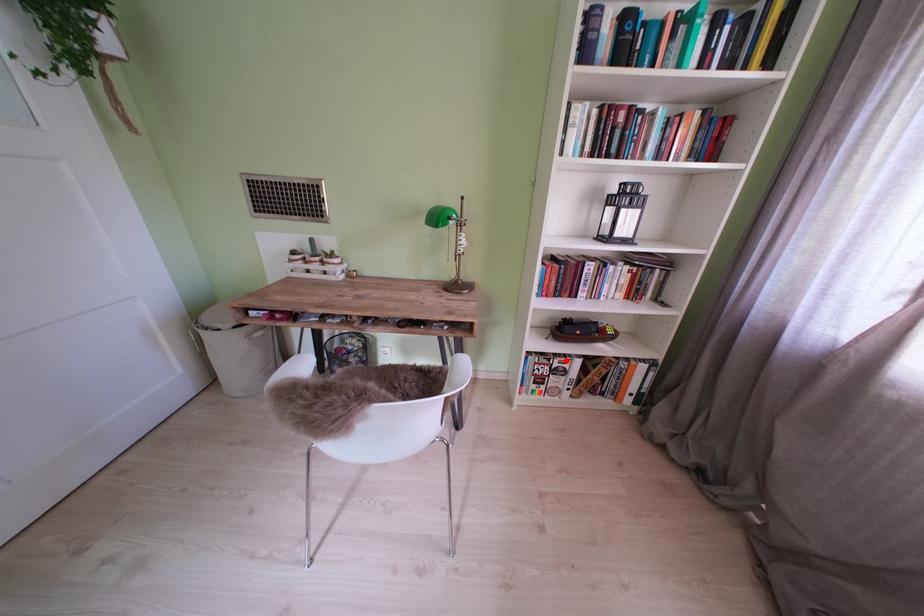
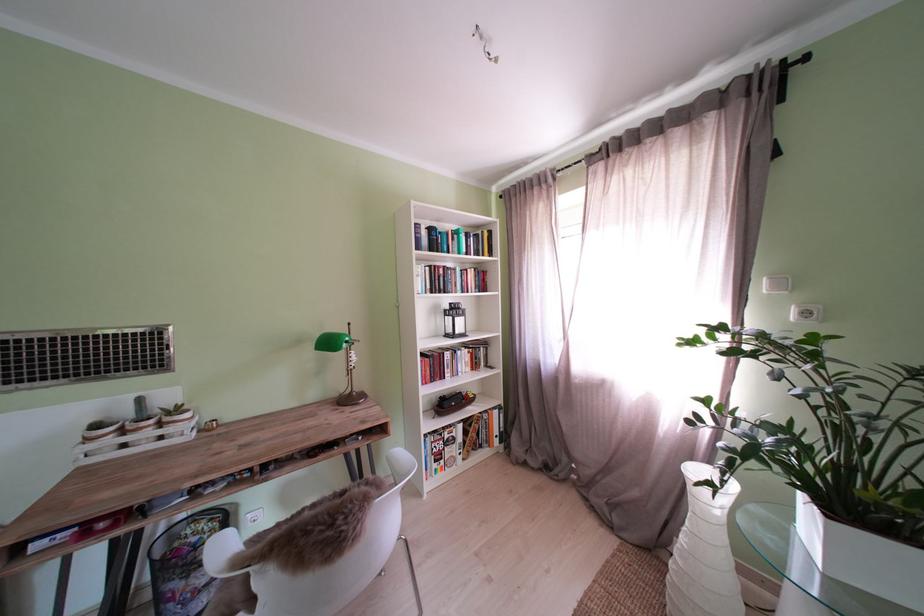
Question: I am providing you with two images of the same scene from different viewpoints. A red point is marked on the first image. Can you still see the location of the red point in image 2?

Choices:
 (A) Yes
 (B) No

Answer: (A)